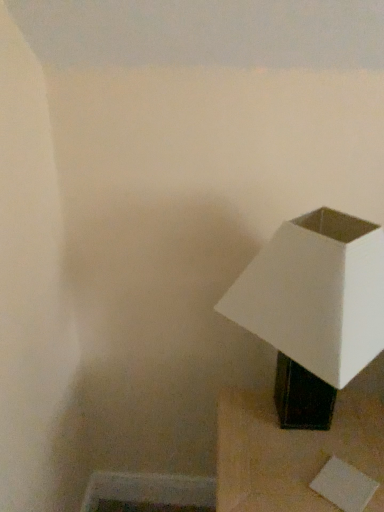
Question: Does black matte lamp at lower right turn towards white matte lampshade at right?

Choices:
 (A) no
 (B) yes

Answer: (A)

Question: Are black matte lamp at lower right and white matte lampshade at right far apart?

Choices:
 (A) no
 (B) yes

Answer: (A)

Question: Does black matte lamp at lower right have a larger size compared to white matte lampshade at right?

Choices:
 (A) no
 (B) yes

Answer: (B)

Question: Does black matte lamp at lower right lie behind white matte lampshade at right?

Choices:
 (A) yes
 (B) no

Answer: (A)

Question: Is black matte lamp at lower right wider than white matte lampshade at right?

Choices:
 (A) yes
 (B) no

Answer: (A)

Question: From a real-world perspective, is black matte lamp at lower right positioned over white matte lampshade at right based on gravity?

Choices:
 (A) no
 (B) yes

Answer: (A)

Question: Can you confirm if white matte lampshade at right is thinner than black matte lamp at lower right?

Choices:
 (A) yes
 (B) no

Answer: (A)

Question: From the image's perspective, is white matte lampshade at right located beneath black matte lamp at lower right?

Choices:
 (A) no
 (B) yes

Answer: (A)

Question: Is white matte lampshade at right taller than black matte lamp at lower right?

Choices:
 (A) no
 (B) yes

Answer: (B)

Question: Can we say white matte lampshade at right lies outside black matte lamp at lower right?

Choices:
 (A) no
 (B) yes

Answer: (B)

Question: From a real-world perspective, does white matte lampshade at right sit lower than black matte lamp at lower right?

Choices:
 (A) yes
 (B) no

Answer: (B)

Question: Is black matte lamp at lower right completely or partially inside white matte lampshade at right?

Choices:
 (A) yes
 (B) no

Answer: (B)

Question: Considering the positions of white matte lampshade at right and black matte lamp at lower right in the image, is white matte lampshade at right bigger or smaller than black matte lamp at lower right?

Choices:
 (A) big
 (B) small

Answer: (B)